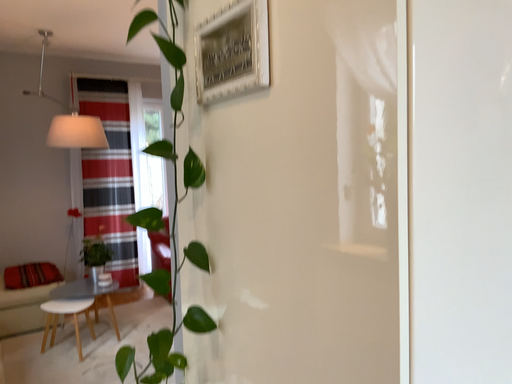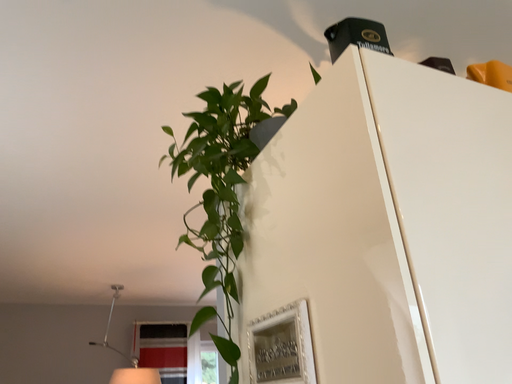
Question: Which way did the camera rotate in the video?

Choices:
 (A) rotated right
 (B) rotated left

Answer: (B)